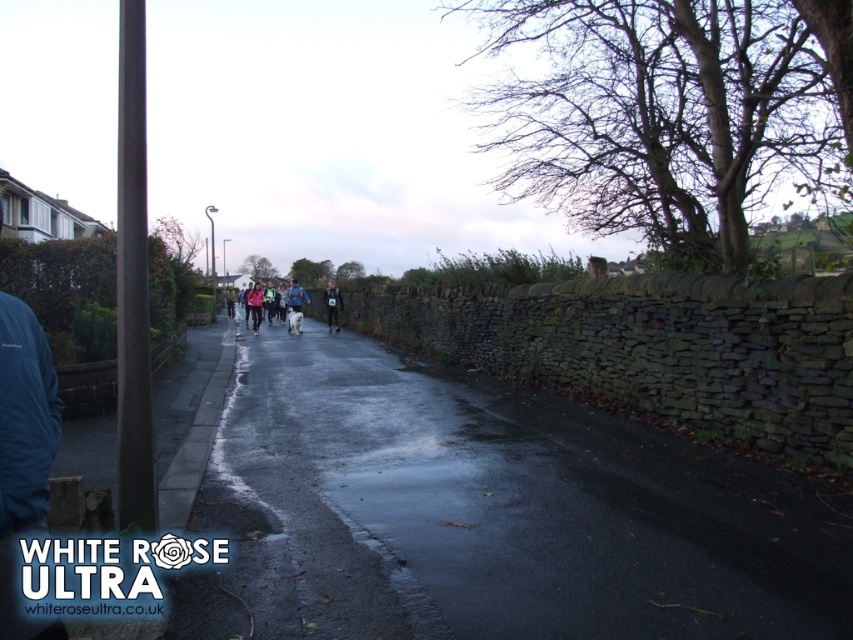
Question: Which object appears closest to the camera in this image?

Choices:
 (A) dark blue running suit at center
 (B) blue softshell jacket at lower left

Answer: (B)

Question: Is dark asphalt pavement at center to the right of blue softshell jacket at lower left from the viewer's perspective?

Choices:
 (A) no
 (B) yes

Answer: (B)

Question: Is dark asphalt pavement at center above white fabric jacket at center?

Choices:
 (A) no
 (B) yes

Answer: (A)

Question: Among these objects, which one is nearest to the camera?

Choices:
 (A) dark asphalt pavement at center
 (B) dark blue running suit at center
 (C) white fabric jacket at center

Answer: (A)

Question: Based on their relative distances, which object is farther from the dark blue running suit at center?

Choices:
 (A) dark asphalt pavement at center
 (B) blue softshell jacket at lower left
 (C) white fabric jacket at center

Answer: (B)

Question: Can you confirm if dark asphalt pavement at center is positioned to the right of dark blue running suit at center?

Choices:
 (A) yes
 (B) no

Answer: (A)